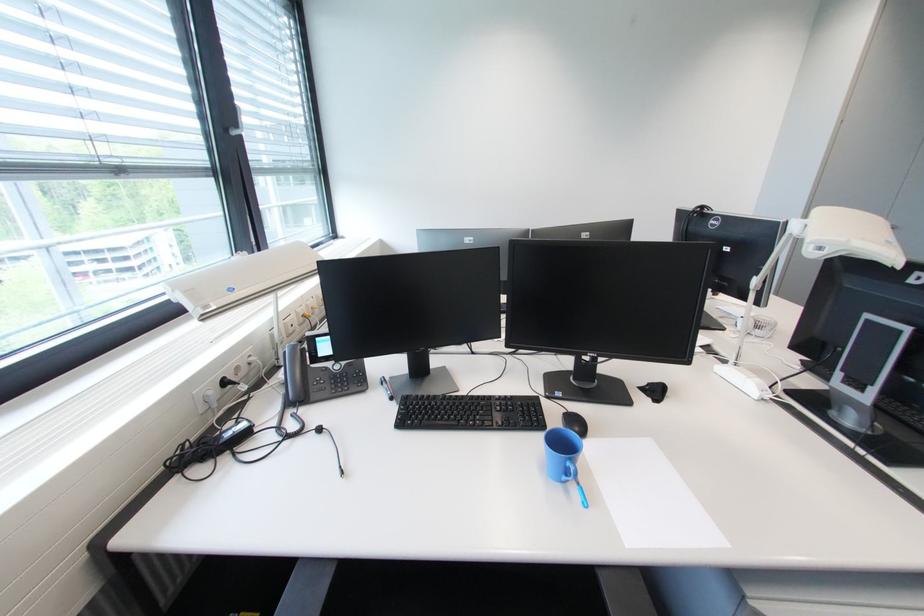
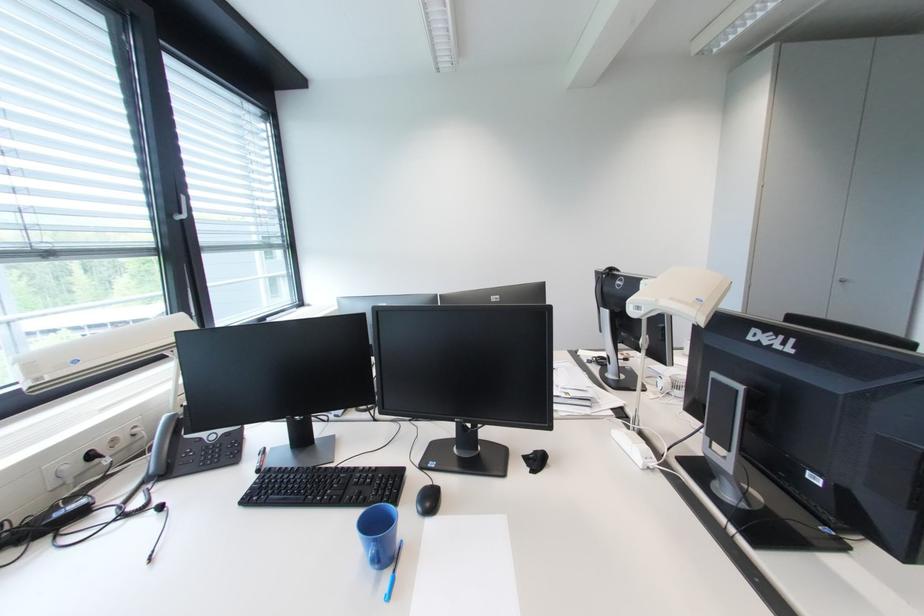
Find the pixel in the second image that matches pixel 232 384 in the first image.

(98, 458)